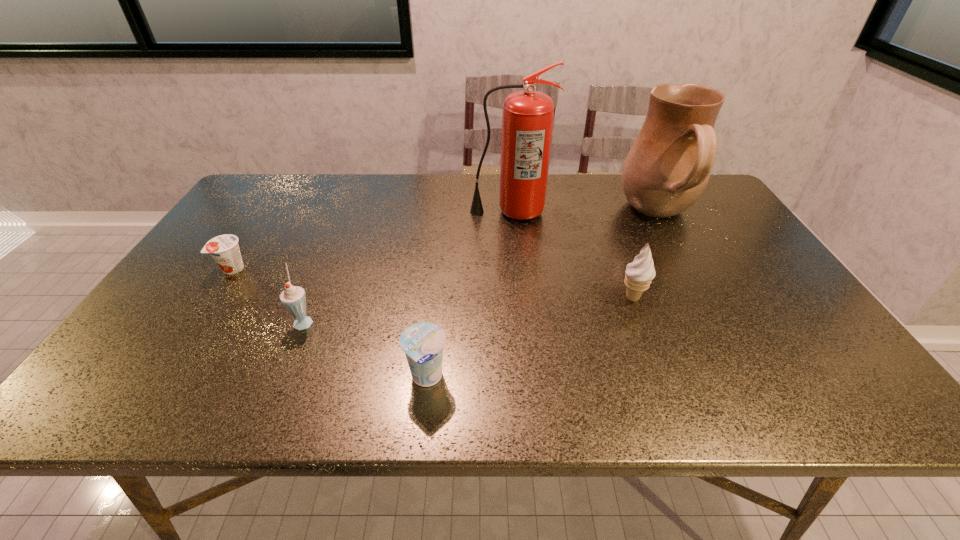
Locate an element on the screen. vacant area situated on the right of the fifth tallest object is located at coordinates (516, 378).

Locate an element on the screen. This screenshot has height=540, width=960. vacant area located 0.310m on the front of the shortest object is located at coordinates (163, 376).

The width and height of the screenshot is (960, 540). Identify the location of fire extinguisher positioned at the far edge. (527, 121).

This screenshot has width=960, height=540. In order to click on cream pitcher at the far edge in this screenshot , I will do `click(667, 169)`.

This screenshot has height=540, width=960. In order to click on object at the near edge in this screenshot , I will do `click(423, 343)`.

The height and width of the screenshot is (540, 960). I want to click on object situated at the left edge, so click(225, 250).

Find the location of `object located in the right edge section of the desktop`. object located in the right edge section of the desktop is located at coordinates (667, 169).

At what (x,y) coordinates should I click in order to perform the action: click on object situated at the far right corner. Please return your answer as a coordinate pair (x, y). Image resolution: width=960 pixels, height=540 pixels. Looking at the image, I should click on (667, 169).

Where is `free space at the far edge of the desktop`? The image size is (960, 540). free space at the far edge of the desktop is located at coordinates tap(609, 200).

Identify the location of vacant space at the near edge. (715, 392).